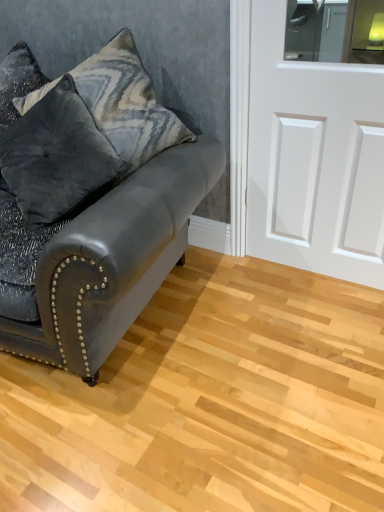
Question: Does white matte door at right have a larger size compared to velvet dark gray pillow at left, which is counted as the first pillow, starting from the bottom?

Choices:
 (A) yes
 (B) no

Answer: (B)

Question: Can you confirm if white matte door at right is taller than velvet dark gray pillow at left, which is counted as the 2th pillow, starting from the top?

Choices:
 (A) yes
 (B) no

Answer: (A)

Question: Is white matte door at right in front of velvet dark gray pillow at left, which is counted as the 2th pillow, starting from the top?

Choices:
 (A) yes
 (B) no

Answer: (B)

Question: Does white matte door at right have a lesser height compared to velvet dark gray pillow at left, which is counted as the 2th pillow, starting from the top?

Choices:
 (A) no
 (B) yes

Answer: (A)

Question: Is white matte door at right behind velvet dark gray pillow at left, which is counted as the 2th pillow, starting from the top?

Choices:
 (A) yes
 (B) no

Answer: (A)

Question: From a real-world perspective, is white matte door at right physically below velvet dark gray pillow at left, which is counted as the first pillow, starting from the bottom?

Choices:
 (A) no
 (B) yes

Answer: (B)

Question: Considering the relative sizes of velvet dark gray pillow at left, which is counted as the first pillow, starting from the bottom, and matte black leather couch at left in the image provided, is velvet dark gray pillow at left, which is counted as the first pillow, starting from the bottom, bigger than matte black leather couch at left?

Choices:
 (A) yes
 (B) no

Answer: (B)

Question: Considering the relative sizes of velvet dark gray pillow at left, which is counted as the first pillow, starting from the bottom, and matte black leather couch at left in the image provided, is velvet dark gray pillow at left, which is counted as the first pillow, starting from the bottom, thinner than matte black leather couch at left?

Choices:
 (A) yes
 (B) no

Answer: (A)

Question: Does velvet dark gray pillow at left, which is counted as the first pillow, starting from the bottom, appear on the right side of matte black leather couch at left?

Choices:
 (A) no
 (B) yes

Answer: (B)

Question: Does velvet dark gray pillow at left, which is counted as the 2th pillow, starting from the top, have a lesser height compared to matte black leather couch at left?

Choices:
 (A) no
 (B) yes

Answer: (B)

Question: From the image's perspective, is velvet dark gray pillow at left, which is counted as the first pillow, starting from the bottom, beneath matte black leather couch at left?

Choices:
 (A) yes
 (B) no

Answer: (B)

Question: Is velvet dark gray pillow at left, which is counted as the first pillow, starting from the bottom, facing towards matte black leather couch at left?

Choices:
 (A) no
 (B) yes

Answer: (B)

Question: Is the depth of velvet gray pillow at upper left, the second pillow positioned from the bottom, less than that of matte black leather couch at left?

Choices:
 (A) yes
 (B) no

Answer: (B)